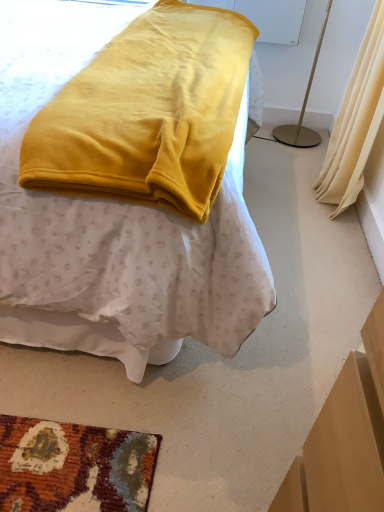
Question: From a real-world perspective, does velvet yellow blanket at center stand above beige fabric curtain at right?

Choices:
 (A) yes
 (B) no

Answer: (A)

Question: Is velvet yellow blanket at center positioned before beige fabric curtain at right?

Choices:
 (A) yes
 (B) no

Answer: (A)

Question: Is velvet yellow blanket at center thinner than beige fabric curtain at right?

Choices:
 (A) no
 (B) yes

Answer: (A)

Question: Is velvet yellow blanket at center far from beige fabric curtain at right?

Choices:
 (A) yes
 (B) no

Answer: (A)

Question: Is beige fabric curtain at right located within velvet yellow blanket at center?

Choices:
 (A) yes
 (B) no

Answer: (B)

Question: From their relative heights in the image, would you say white plastic lampshade at upper right is taller or shorter than velvet yellow blanket at center?

Choices:
 (A) tall
 (B) short

Answer: (B)

Question: From a real-world perspective, is white plastic lampshade at upper right above or below velvet yellow blanket at center?

Choices:
 (A) below
 (B) above

Answer: (A)

Question: Is white plastic lampshade at upper right bigger or smaller than velvet yellow blanket at center?

Choices:
 (A) small
 (B) big

Answer: (A)

Question: Is white plastic lampshade at upper right inside or outside of velvet yellow blanket at center?

Choices:
 (A) inside
 (B) outside

Answer: (B)

Question: Does point (354, 140) appear closer or farther from the camera than point (34, 221)?

Choices:
 (A) farther
 (B) closer

Answer: (A)

Question: Is beige fabric curtain at right situated inside velvet yellow blanket at center or outside?

Choices:
 (A) outside
 (B) inside

Answer: (A)

Question: From a real-world perspective, is beige fabric curtain at right above or below velvet yellow blanket at center?

Choices:
 (A) below
 (B) above

Answer: (A)

Question: Is beige fabric curtain at right taller or shorter than velvet yellow blanket at center?

Choices:
 (A) tall
 (B) short

Answer: (B)

Question: In the image, is white plastic lampshade at upper right on the left side or the right side of beige fabric curtain at right?

Choices:
 (A) right
 (B) left

Answer: (B)

Question: Choose the correct answer: Is white plastic lampshade at upper right inside beige fabric curtain at right or outside it?

Choices:
 (A) outside
 (B) inside

Answer: (A)